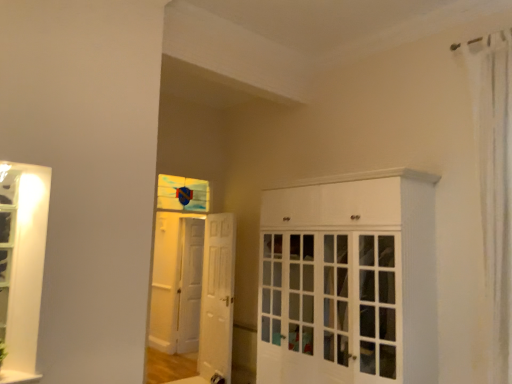
Question: Is white sheer curtain at right oriented towards white wooden door at center, which appears as the 1th door when viewed from the front?

Choices:
 (A) yes
 (B) no

Answer: (B)

Question: Is the depth of white sheer curtain at right greater than that of white wooden door at center, the 2th door when ordered from left to right?

Choices:
 (A) yes
 (B) no

Answer: (B)

Question: Is white wooden door at center, the first door from the right, a part of white sheer curtain at right?

Choices:
 (A) yes
 (B) no

Answer: (B)

Question: Can you confirm if white sheer curtain at right is positioned to the right of white wooden door at center, the first door from the right?

Choices:
 (A) no
 (B) yes

Answer: (B)

Question: Is white sheer curtain at right not close to white wooden door at center, the first door from the right?

Choices:
 (A) no
 (B) yes

Answer: (B)

Question: Choose the correct answer: Is stained glass window at center inside white glossy door at center, which ranks as the 2th door in front-to-back order, or outside it?

Choices:
 (A) outside
 (B) inside

Answer: (A)

Question: From the image's perspective, is stained glass window at center positioned above or below white glossy door at center, which is counted as the 2th door, starting from the right?

Choices:
 (A) below
 (B) above

Answer: (B)

Question: Considering the positions of point (169, 203) and point (197, 349), is point (169, 203) closer or farther from the camera than point (197, 349)?

Choices:
 (A) farther
 (B) closer

Answer: (A)

Question: From a real-world perspective, is stained glass window at center positioned above or below white glossy door at center, which is counted as the 2th door, starting from the right?

Choices:
 (A) above
 (B) below

Answer: (A)

Question: Is white glossy window sill at lower left taller or shorter than white glossy door at center, marked as the 1th door in a back-to-front arrangement?

Choices:
 (A) tall
 (B) short

Answer: (B)

Question: Is point (28, 380) closer or farther from the camera than point (202, 230)?

Choices:
 (A) farther
 (B) closer

Answer: (B)

Question: Is white glossy window sill at lower left bigger or smaller than white glossy door at center, marked as the 1th door in a back-to-front arrangement?

Choices:
 (A) big
 (B) small

Answer: (B)

Question: From a real-world perspective, is white glossy window sill at lower left physically located above or below white glossy door at center, the 1th door when ordered from left to right?

Choices:
 (A) above
 (B) below

Answer: (B)

Question: From the image's perspective, is white wooden door at center, the 2th door when ordered from left to right, located above or below white sheer curtain at right?

Choices:
 (A) below
 (B) above

Answer: (A)

Question: From a real-world perspective, is white wooden door at center, which appears as the 1th door when viewed from the front, physically located above or below white sheer curtain at right?

Choices:
 (A) above
 (B) below

Answer: (B)